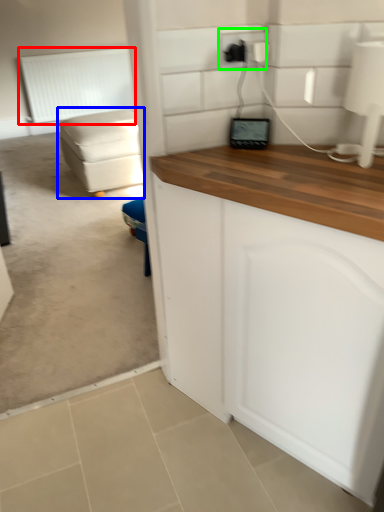
Question: Which object is the closest to the radiator (highlighted by a red box)? Choose among these: studio couch (highlighted by a blue box) or electric outlet (highlighted by a green box).

Choices:
 (A) studio couch
 (B) electric outlet

Answer: (A)